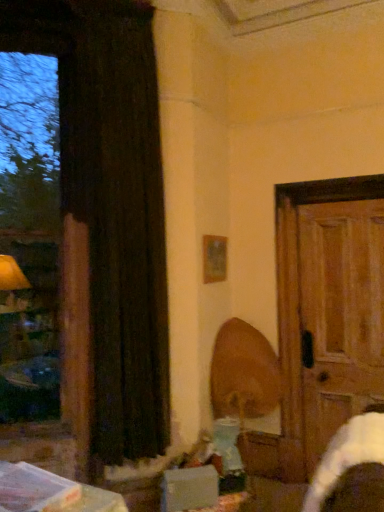
Find the location of `blank space situated above white cardboard box at lower center (from a real-world perspective)`. blank space situated above white cardboard box at lower center (from a real-world perspective) is located at coordinates (187, 468).